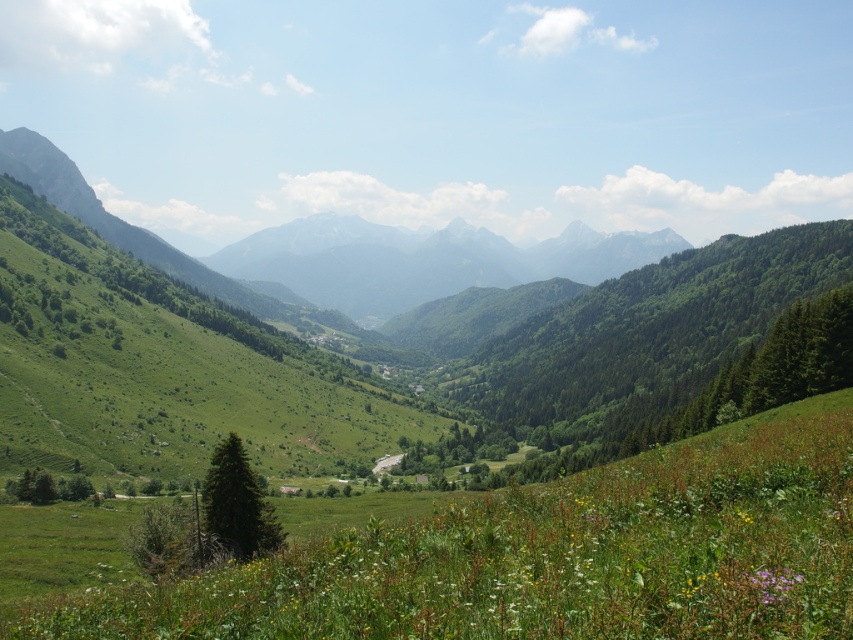
Looking at this image, you are an environmental scientist assessing the landscape. You need to determine which object, the green leafy tree at center or the green grassy mountain at center, is taller. Based on the scene, which one is taller?

Answer: The green leafy tree at center has a lesser height compared to green grassy mountain at center, so the green grassy mountain at center is taller.

You are standing at the camera position looking at the mountain landscape. There are two points marked in the image, one at point (616, 452) and the other at point (384, 241). Which point is closer to you?

Point (616, 452) is closer to the camera than point (384, 241).

You are standing at the origin point of the coordinate system in the image. You want to walk towards the green matte tree at lower left. What are the coordinates you need to move to reach it?

The coordinates of the green matte tree at lower left are at point (236, 502), so you need to move to that coordinate point to reach it.